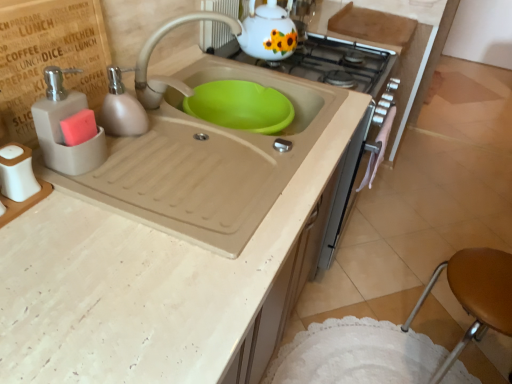
The height and width of the screenshot is (384, 512). Identify the location of unoccupied area behind brown leather stool at lower right. (409, 295).